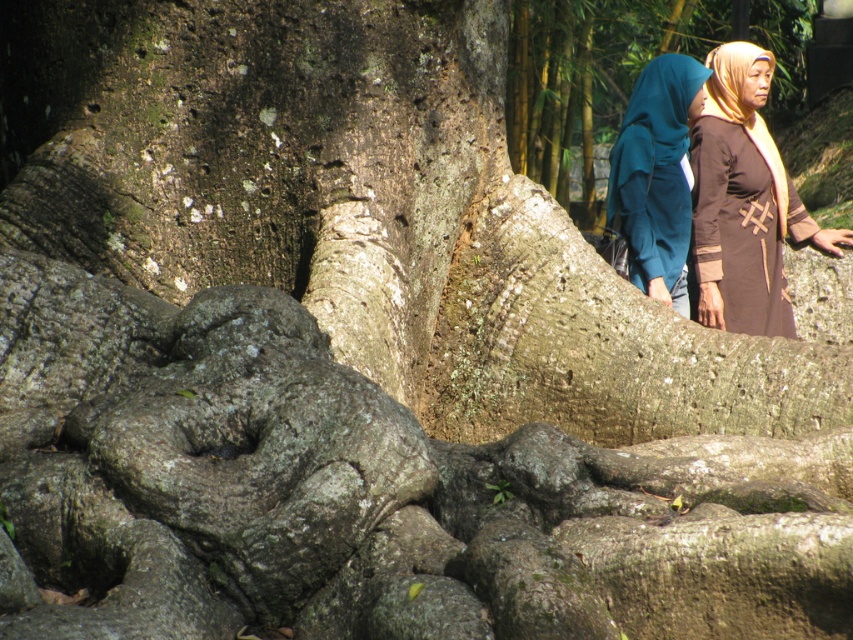
Question: Can you confirm if teal fabric hijab at upper right is positioned to the right of brown woven shawl at upper right?

Choices:
 (A) yes
 (B) no

Answer: (B)

Question: Which point appears farthest from the camera in this image?

Choices:
 (A) (784, 310)
 (B) (717, 49)

Answer: (B)

Question: Among these objects, which one is nearest to the camera?

Choices:
 (A) brown woven shawl at upper right
 (B) teal fabric hijab at upper right

Answer: (B)

Question: Does brown matte robe at right appear on the left side of teal fabric hijab at upper right?

Choices:
 (A) yes
 (B) no

Answer: (B)

Question: Is the position of brown matte robe at right more distant than that of brown woven shawl at upper right?

Choices:
 (A) no
 (B) yes

Answer: (A)

Question: Which point is farther from the camera taking this photo?

Choices:
 (A) (639, 220)
 (B) (764, 157)
 (C) (810, 230)

Answer: (C)